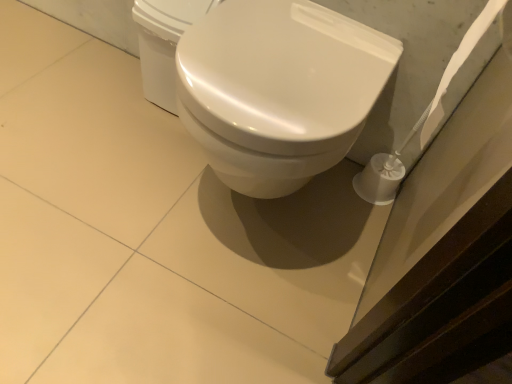
The width and height of the screenshot is (512, 384). What are the coordinates of `free space below white glossy toilet at center (from a real-world perspective)` in the screenshot? It's located at (236, 216).